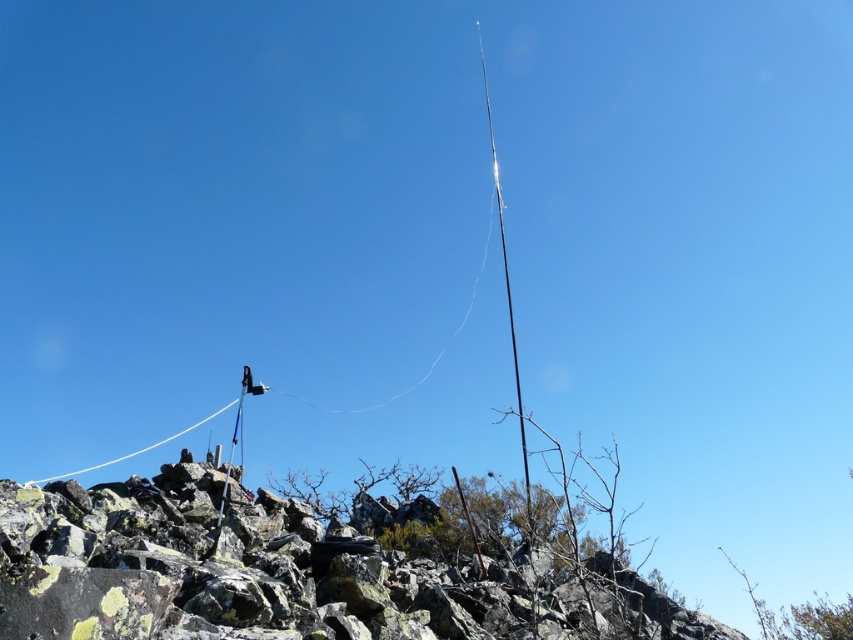
Can you confirm if rough stone hill at center is thinner than white string at upper left?

Indeed, rough stone hill at center has a lesser width compared to white string at upper left.

Who is positioned more to the left, rough stone hill at center or white string at upper left?

white string at upper left is more to the left.

Which is behind, point (134, 611) or point (39, 481)?

Point (39, 481)

You are a GUI agent. You are given a task and a screenshot of the screen. Output one action in this format:
    pyautogui.click(x=<x>, y=<y>)
    Task: Click on the rough stone hill at center
    
    Given the screenshot: What is the action you would take?
    pyautogui.click(x=281, y=573)